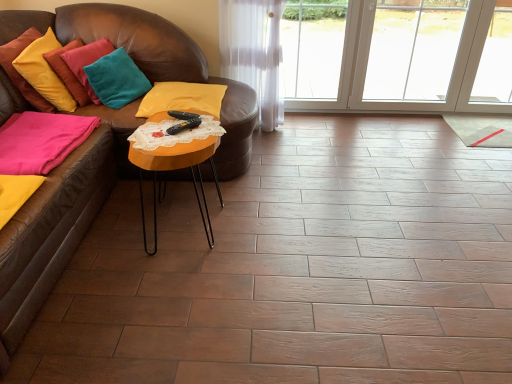
This screenshot has height=384, width=512. Describe the element at coordinates (175, 169) in the screenshot. I see `orange wood table at center` at that location.

Find the location of a particular element. The image size is (512, 384). yellow velvet pillow at center, which is the 4th pillow in left-to-right order is located at coordinates (182, 99).

Describe the element at coordinates (41, 141) in the screenshot. I see `pink fabric pillow at lower left, which is the third pillow in right-to-left order` at that location.

Where is `velvet yellow pillow at upper left, the fourth pillow viewed from the right`? The height and width of the screenshot is (384, 512). velvet yellow pillow at upper left, the fourth pillow viewed from the right is located at coordinates (44, 72).

This screenshot has width=512, height=384. Describe the element at coordinates (44, 72) in the screenshot. I see `velvet yellow pillow at upper left, the fourth pillow viewed from the right` at that location.

Image resolution: width=512 pixels, height=384 pixels. I want to click on orange wood table at center, so click(x=175, y=169).

What are the coordinates of `the 2nd pillow behind the pink fabric pillow at lower left, which is the third pillow in right-to-left order` in the screenshot? It's located at (116, 79).

Considering the relative sizes of teal velvet pillow at upper left, which ranks as the second pillow in right-to-left order, and pink fabric pillow at lower left, the second pillow from the left, in the image provided, is teal velvet pillow at upper left, which ranks as the second pillow in right-to-left order, smaller than pink fabric pillow at lower left, the second pillow from the left,?

No, teal velvet pillow at upper left, which ranks as the second pillow in right-to-left order, is not smaller than pink fabric pillow at lower left, the second pillow from the left.

Is teal velvet pillow at upper left, which ranks as the second pillow in right-to-left order, oriented away from pink fabric pillow at lower left, the second pillow from the left?

teal velvet pillow at upper left, which ranks as the second pillow in right-to-left order, does not have its back to pink fabric pillow at lower left, the second pillow from the left.

From the image's perspective, would you say teal velvet pillow at upper left, which is the 3th pillow from left to right, is shown under pink fabric pillow at lower left, the second pillow from the left?

No.

What are the coordinates of `table that is on the right side of teal velvet pillow at upper left, which ranks as the second pillow in right-to-left order` in the screenshot? It's located at (175, 169).

From the picture: Relative to teal velvet pillow at upper left, which is the 3th pillow from left to right, is orange wood table at center in front or behind?

orange wood table at center is in front of teal velvet pillow at upper left, which is the 3th pillow from left to right.

How different are the orientations of orange wood table at center and teal velvet pillow at upper left, which is the 3th pillow from left to right, in degrees?

The facing directions of orange wood table at center and teal velvet pillow at upper left, which is the 3th pillow from left to right, are 29.9 degrees apart.

Are orange wood table at center and teal velvet pillow at upper left, which ranks as the second pillow in right-to-left order, beside each other?

orange wood table at center is not next to teal velvet pillow at upper left, which ranks as the second pillow in right-to-left order, and they're not touching.

Which object is wider, teal velvet pillow at upper left, which ranks as the second pillow in right-to-left order, or orange wood table at center?

orange wood table at center is wider.

From the picture: Is teal velvet pillow at upper left, which ranks as the second pillow in right-to-left order, touching orange wood table at center?

No.

Considering the positions of objects teal velvet pillow at upper left, which ranks as the second pillow in right-to-left order, and orange wood table at center in the image provided, who is more to the left, teal velvet pillow at upper left, which ranks as the second pillow in right-to-left order, or orange wood table at center?

teal velvet pillow at upper left, which ranks as the second pillow in right-to-left order, is more to the left.

Is yellow velvet pillow at center, which is the 4th pillow in left-to-right order, far away from teal velvet pillow at upper left, which ranks as the second pillow in right-to-left order?

yellow velvet pillow at center, which is the 4th pillow in left-to-right order, is near teal velvet pillow at upper left, which ranks as the second pillow in right-to-left order, not far away.

Is yellow velvet pillow at center, which is the 4th pillow in left-to-right order, taller than teal velvet pillow at upper left, which ranks as the second pillow in right-to-left order?

No.

Can you confirm if yellow velvet pillow at center, which is the 4th pillow in left-to-right order, is positioned to the left of teal velvet pillow at upper left, which is the 3th pillow from left to right?

No.

Does yellow velvet pillow at center, positioned as the first pillow in right-to-left order, come behind teal velvet pillow at upper left, which ranks as the second pillow in right-to-left order?

Yes, it is behind teal velvet pillow at upper left, which ranks as the second pillow in right-to-left order.

How many degrees apart are the facing directions of teal velvet pillow at upper left, which ranks as the second pillow in right-to-left order, and yellow velvet pillow at center, which is the 4th pillow in left-to-right order?

There is a 61.3-degree angle between the facing directions of teal velvet pillow at upper left, which ranks as the second pillow in right-to-left order, and yellow velvet pillow at center, which is the 4th pillow in left-to-right order.

From the image's perspective, does teal velvet pillow at upper left, which ranks as the second pillow in right-to-left order, appear lower than yellow velvet pillow at center, which is the 4th pillow in left-to-right order?

Actually, teal velvet pillow at upper left, which ranks as the second pillow in right-to-left order, appears above yellow velvet pillow at center, which is the 4th pillow in left-to-right order, in the image.

Is point (104, 94) more distant than point (196, 102)?

Yes, point (104, 94) is farther from viewer.

Looking at the image, does teal velvet pillow at upper left, which is the 3th pillow from left to right, seem bigger or smaller compared to yellow velvet pillow at center, positioned as the first pillow in right-to-left order?

In the image, teal velvet pillow at upper left, which is the 3th pillow from left to right, appears to be larger than yellow velvet pillow at center, positioned as the first pillow in right-to-left order.

Based on the photo, do you think pink fabric pillow at lower left, which is the third pillow in right-to-left order, is within orange wood table at center, or outside of it?

pink fabric pillow at lower left, which is the third pillow in right-to-left order, exists outside the volume of orange wood table at center.

Looking at their sizes, would you say pink fabric pillow at lower left, the second pillow from the left, is wider or thinner than orange wood table at center?

Clearly, pink fabric pillow at lower left, the second pillow from the left, has more width compared to orange wood table at center.

How different are the orientations of yellow velvet pillow at center, positioned as the first pillow in right-to-left order, and pink fabric pillow at lower left, the second pillow from the left, in degrees?

The angle between the facing direction of yellow velvet pillow at center, positioned as the first pillow in right-to-left order, and the facing direction of pink fabric pillow at lower left, the second pillow from the left, is 90.4 degrees.

Which of these two, yellow velvet pillow at center, positioned as the first pillow in right-to-left order, or pink fabric pillow at lower left, which is the third pillow in right-to-left order, is wider?

Wider between the two is yellow velvet pillow at center, positioned as the first pillow in right-to-left order.

From the picture: Would you consider yellow velvet pillow at center, which is the 4th pillow in left-to-right order, to be distant from pink fabric pillow at lower left, the second pillow from the left?

No, yellow velvet pillow at center, which is the 4th pillow in left-to-right order, is not far from pink fabric pillow at lower left, the second pillow from the left.

Does point (173, 102) come closer to viewer compared to point (31, 151)?

No, it is not.

What are the coordinates of `the 2nd pillow in front of the teal velvet pillow at upper left, which ranks as the second pillow in right-to-left order, starting your count from the anchor` in the screenshot? It's located at point(41,141).

You are a GUI agent. You are given a task and a screenshot of the screen. Output one action in this format:
    pyautogui.click(x=<x>, y=<y>)
    Task: Click on the table on the right of teal velvet pillow at upper left, which ranks as the second pillow in right-to-left order
    
    Given the screenshot: What is the action you would take?
    pyautogui.click(x=175, y=169)

Based on their spatial positions, is teal velvet pillow at upper left, which ranks as the second pillow in right-to-left order, or yellow velvet pillow at center, which is the 4th pillow in left-to-right order, further from orange wood table at center?

teal velvet pillow at upper left, which ranks as the second pillow in right-to-left order.

From the image, which object appears to be farther from yellow velvet pillow at center, positioned as the first pillow in right-to-left order, teal velvet pillow at upper left, which is the 3th pillow from left to right, or orange wood table at center?

The object further to yellow velvet pillow at center, positioned as the first pillow in right-to-left order, is orange wood table at center.

Which object lies further to the anchor point velvet yellow pillow at upper left, the fourth pillow viewed from the right, pink fabric pillow at lower left, the second pillow from the left, or teal velvet pillow at upper left, which is the 3th pillow from left to right?

pink fabric pillow at lower left, the second pillow from the left, is positioned further to the anchor velvet yellow pillow at upper left, the fourth pillow viewed from the right.

When comparing their distances from velvet yellow pillow at upper left, which is the 1th pillow from left to right, does teal velvet pillow at upper left, which ranks as the second pillow in right-to-left order, or orange wood table at center seem further?

orange wood table at center.

Looking at the image, which one is located closer to yellow velvet pillow at center, positioned as the first pillow in right-to-left order, teal velvet pillow at upper left, which ranks as the second pillow in right-to-left order, or velvet yellow pillow at upper left, which is the 1th pillow from left to right?

teal velvet pillow at upper left, which ranks as the second pillow in right-to-left order, is closer to yellow velvet pillow at center, positioned as the first pillow in right-to-left order.

In the scene shown: From the image, which object appears to be farther from teal velvet pillow at upper left, which ranks as the second pillow in right-to-left order, pink fabric pillow at lower left, which is the third pillow in right-to-left order, or orange wood table at center?

Among the two, orange wood table at center is located further to teal velvet pillow at upper left, which ranks as the second pillow in right-to-left order.

Estimate the real-world distances between objects in this image. Which object is closer to teal velvet pillow at upper left, which ranks as the second pillow in right-to-left order, pink fabric pillow at lower left, which is the third pillow in right-to-left order, or yellow velvet pillow at center, positioned as the first pillow in right-to-left order?

Based on the image, yellow velvet pillow at center, positioned as the first pillow in right-to-left order, appears to be nearer to teal velvet pillow at upper left, which ranks as the second pillow in right-to-left order.

Estimate the real-world distances between objects in this image. Which object is further from pink fabric pillow at lower left, the second pillow from the left, velvet yellow pillow at upper left, the fourth pillow viewed from the right, or yellow velvet pillow at center, which is the 4th pillow in left-to-right order?

Based on the image, yellow velvet pillow at center, which is the 4th pillow in left-to-right order, appears to be further to pink fabric pillow at lower left, the second pillow from the left.

Where is `pillow located between pink fabric pillow at lower left, the second pillow from the left, and yellow velvet pillow at center, which is the 4th pillow in left-to-right order, in the left-right direction`? The height and width of the screenshot is (384, 512). pillow located between pink fabric pillow at lower left, the second pillow from the left, and yellow velvet pillow at center, which is the 4th pillow in left-to-right order, in the left-right direction is located at coordinates (116, 79).

Find the location of `pillow between pink fabric pillow at lower left, which is the third pillow in right-to-left order, and teal velvet pillow at upper left, which is the 3th pillow from left to right, in the front-back direction`. pillow between pink fabric pillow at lower left, which is the third pillow in right-to-left order, and teal velvet pillow at upper left, which is the 3th pillow from left to right, in the front-back direction is located at coordinates (44, 72).